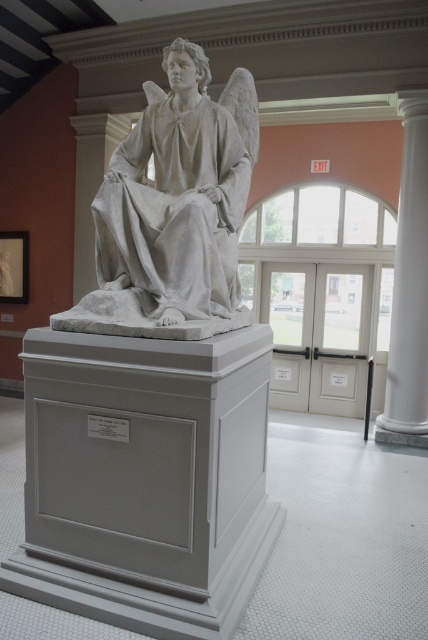
How far apart are white matte pedestal at center and white marble column at right?

The distance of white matte pedestal at center from white marble column at right is 3.48 meters.

Which is below, white matte pedestal at center or white marble column at right?

Positioned lower is white matte pedestal at center.

What do you see at coordinates (145, 480) in the screenshot? I see `white matte pedestal at center` at bounding box center [145, 480].

Locate an element on the screen. white matte pedestal at center is located at coordinates (145, 480).

Is white matte pedestal at center above white marble statue at center?

Actually, white matte pedestal at center is below white marble statue at center.

Does white matte pedestal at center have a smaller size compared to white marble statue at center?

Incorrect, white matte pedestal at center is not smaller in size than white marble statue at center.

Between point (211, 477) and point (202, 92), which one is positioned behind?

Point (202, 92)

I want to click on white matte pedestal at center, so click(145, 480).

Who is higher up, white marble statue at center or white marble column at right?

white marble statue at center is higher up.

Does white marble statue at center have a greater height compared to white marble column at right?

Incorrect, white marble statue at center's height is not larger of white marble column at right's.

Which is behind, point (205, 282) or point (416, 294)?

Positioned behind is point (416, 294).

You are a GUI agent. You are given a task and a screenshot of the screen. Output one action in this format:
    pyautogui.click(x=<x>, y=<y>)
    Task: Click on the white marble statue at center
    The height and width of the screenshot is (640, 428).
    Given the screenshot: What is the action you would take?
    pyautogui.click(x=174, y=209)